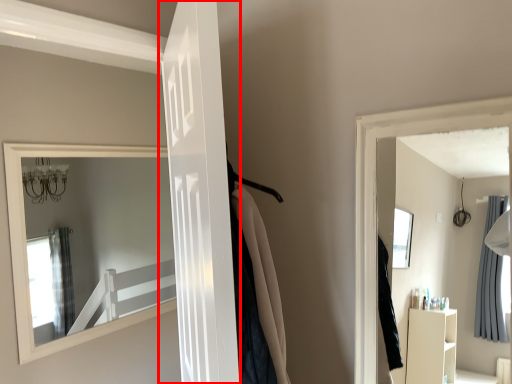
Question: From the image, what is the correct spatial relationship of door (annotated by the red box) in relation to door?

Choices:
 (A) right
 (B) left

Answer: (A)